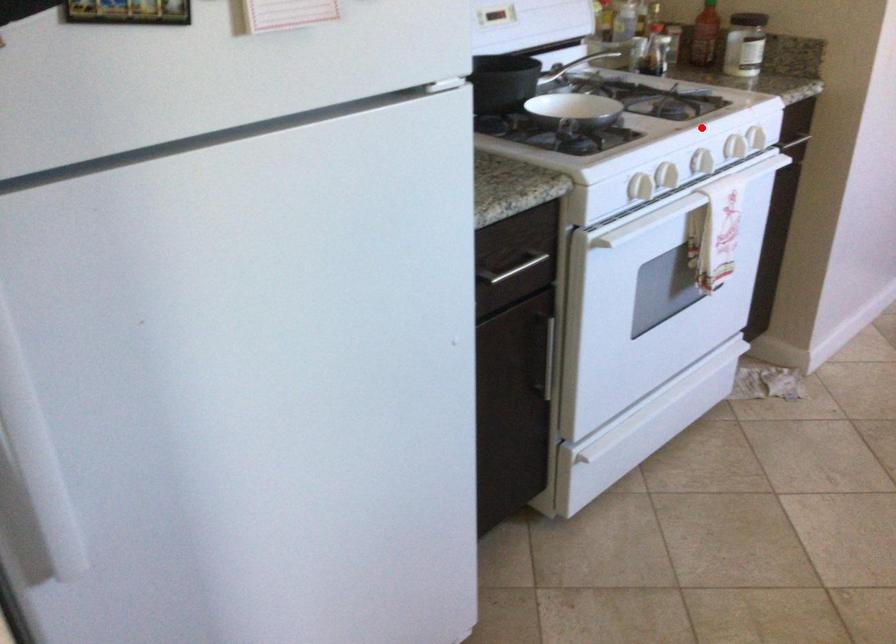
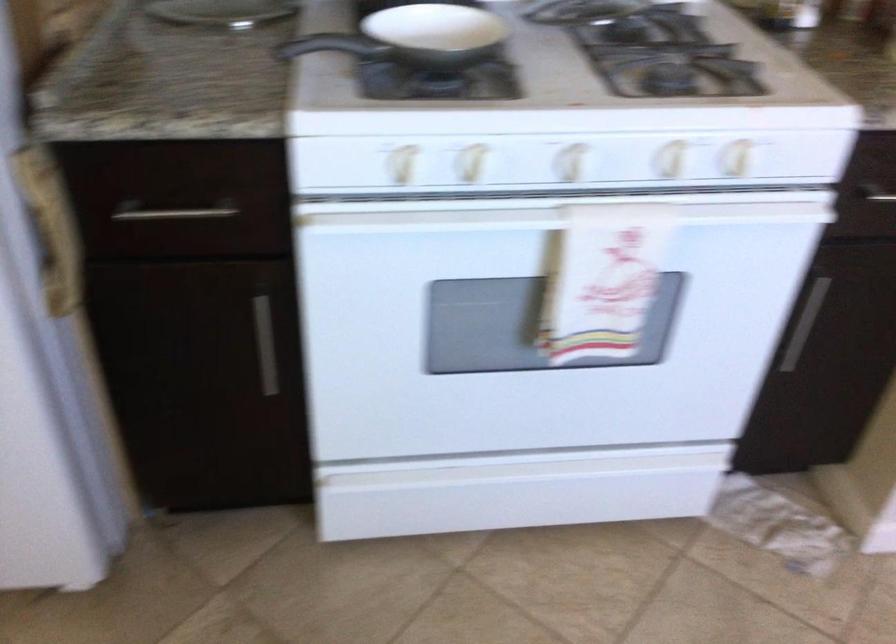
Question: I am providing you with two images of the same scene from different viewpoints. Image1 has a red point marked. In image2, the corresponding 3D location appears at what relative position? Reply with the corresponding letter.

Choices:
 (A) Closer
 (B) Farther

Answer: (A)